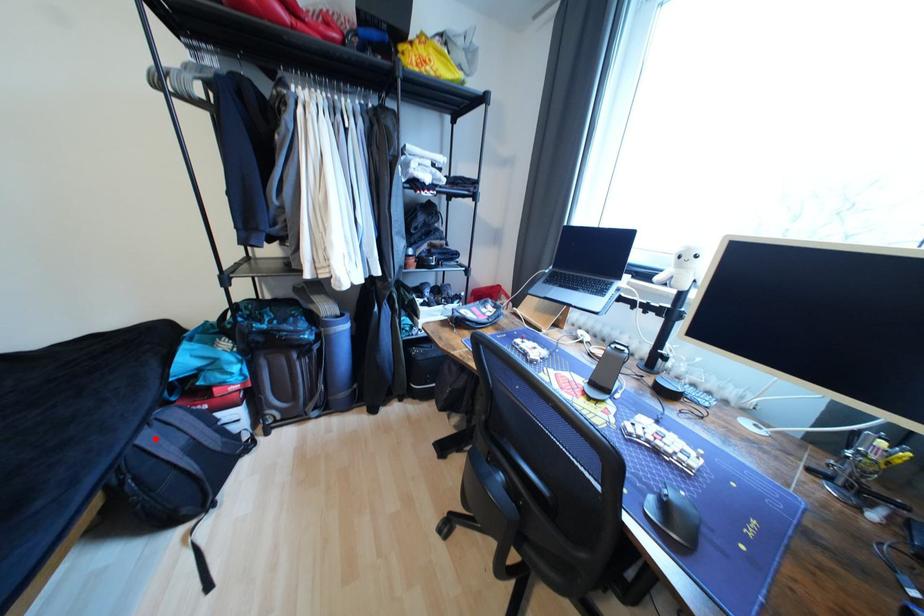
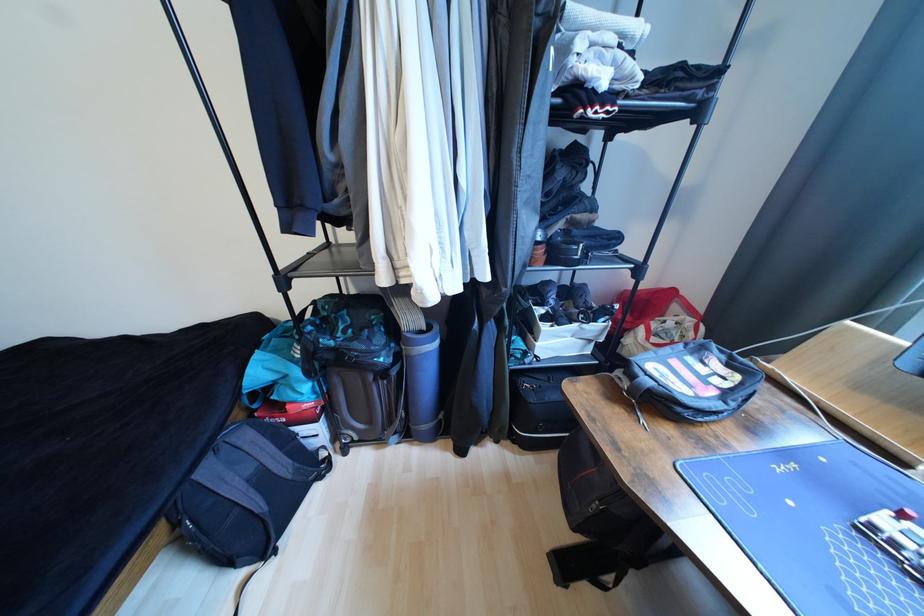
In the second image, find the point that corresponds to the highlighted location in the first image.

(215, 472)